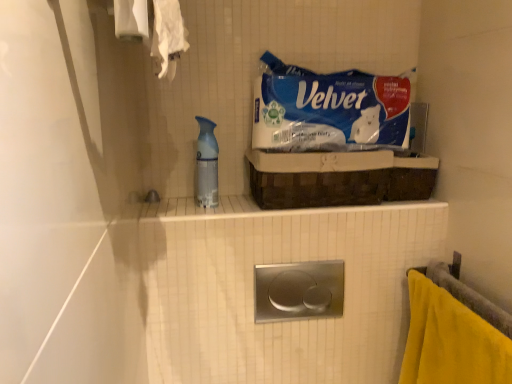
Find the location of a particular element. This screenshot has height=384, width=512. vacant space situated on the left part of translucent plastic spray bottle at center is located at coordinates (169, 210).